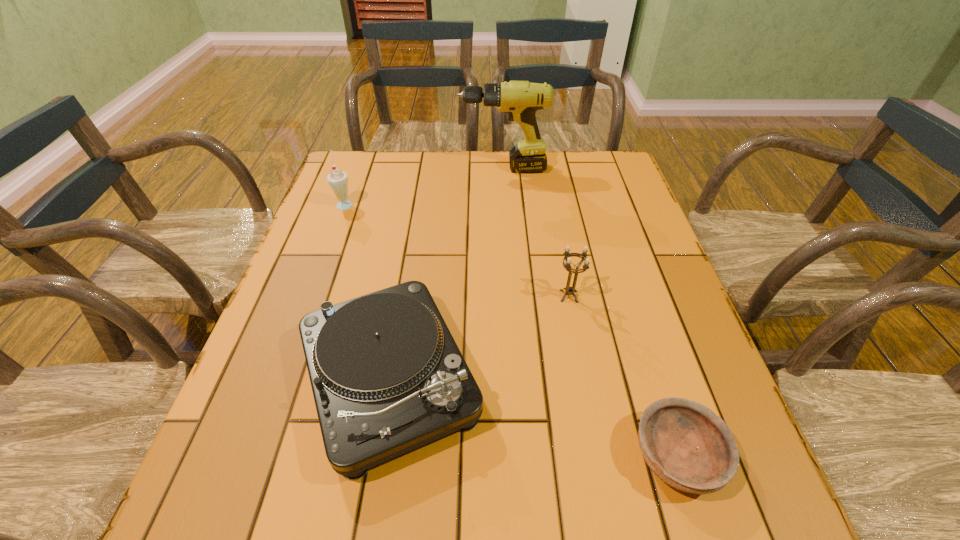
Find the location of a particular element. The width and height of the screenshot is (960, 540). free space between the candle holder and the shortest object is located at coordinates (623, 376).

Identify the location of vacant area that lies between the rightmost object and the second shortest object. (534, 417).

At what (x,y) coordinates should I click in order to perform the action: click on blank region between the rightmost object and the farthest object. Please return your answer as a coordinate pair (x, y). This screenshot has width=960, height=540. Looking at the image, I should click on (590, 313).

Image resolution: width=960 pixels, height=540 pixels. What are the coordinates of `vacant area between the milkshake and the second shortest object` in the screenshot? It's located at (368, 292).

I want to click on free space between the leftmost object and the tallest object, so click(424, 186).

Identify the location of free space between the farthest object and the fourth tallest object. (446, 274).

What are the coordinates of `free space between the drill and the milkshake` in the screenshot? It's located at (424, 186).

Locate an element on the screen. unoccupied position between the shortest object and the milkshake is located at coordinates (511, 330).

Identify the location of object that is the closest one to the record player. Image resolution: width=960 pixels, height=540 pixels. (569, 290).

The height and width of the screenshot is (540, 960). In order to click on object that is the fourth closest one to the farthest object in this screenshot , I will do `click(684, 443)`.